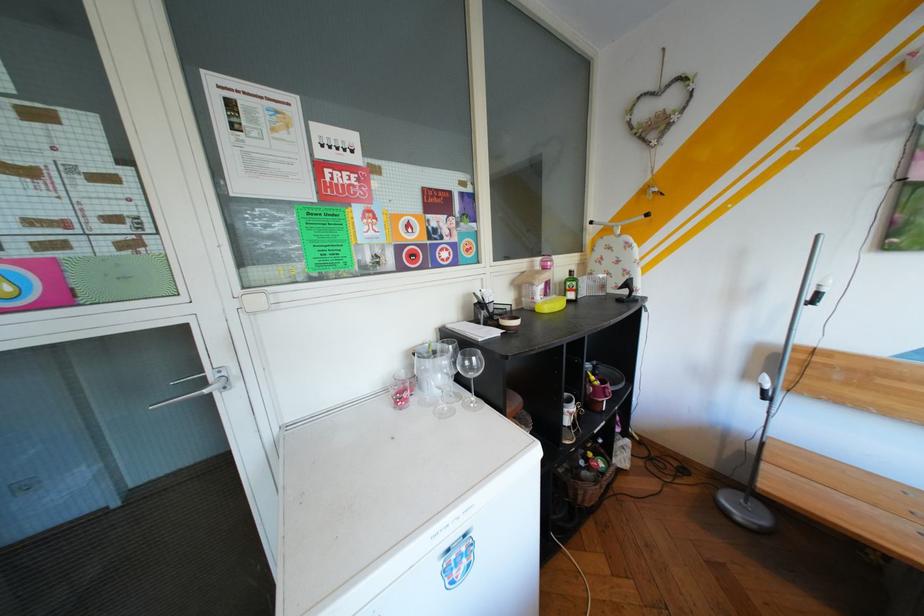
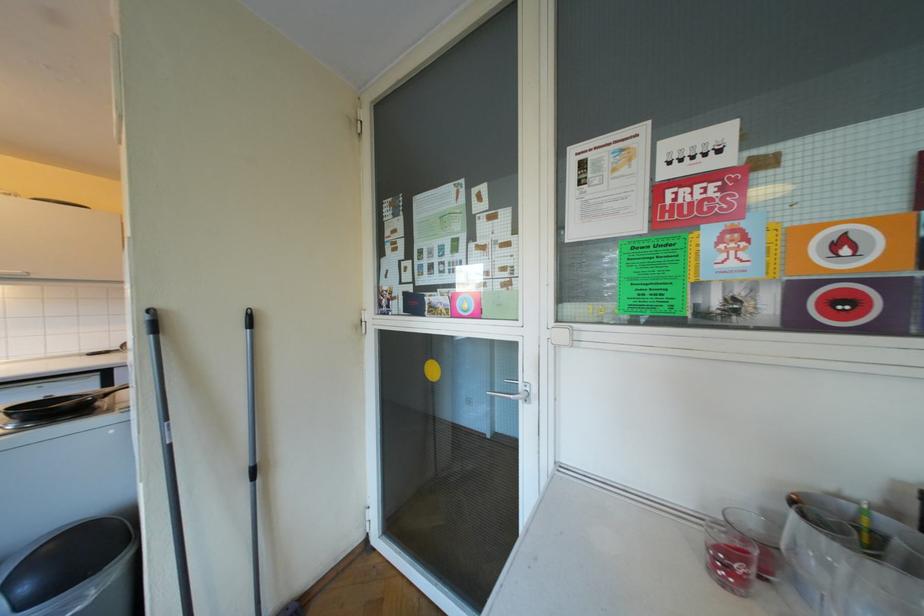
Where in the second image is the point corresponding to pixel 224 392 from the first image?

(529, 400)